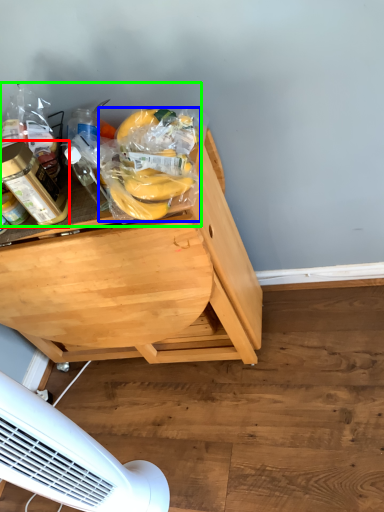
Question: Based on their relative distances, which object is nearer to bottle (highlighted by a red box)? Choose from food (highlighted by a blue box) and food (highlighted by a green box).

Choices:
 (A) food
 (B) food

Answer: (B)